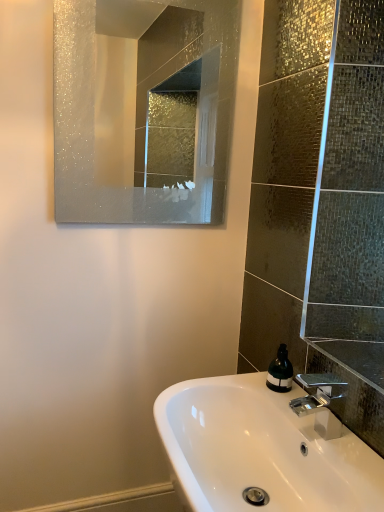
The height and width of the screenshot is (512, 384). In order to click on free space in front of polished chrome faucet at lower right in this screenshot , I will do `click(347, 465)`.